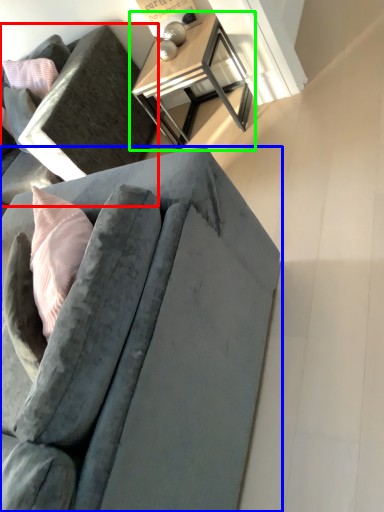
Question: Considering the real-world distances, which object is closest to studio couch (highlighted by a red box)? studio couch (highlighted by a blue box) or table (highlighted by a green box).

Choices:
 (A) studio couch
 (B) table

Answer: (B)